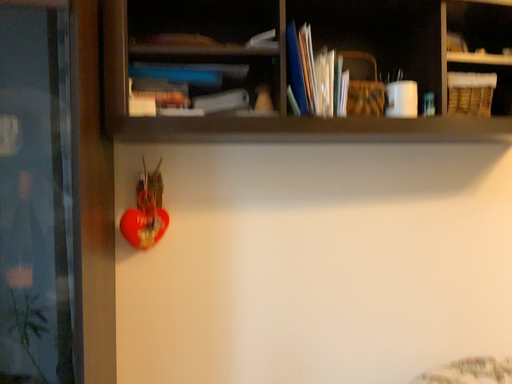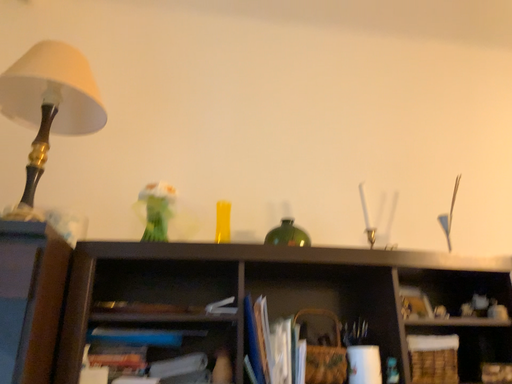
Question: How did the camera likely rotate when shooting the video?

Choices:
 (A) rotated downward
 (B) rotated upward

Answer: (B)